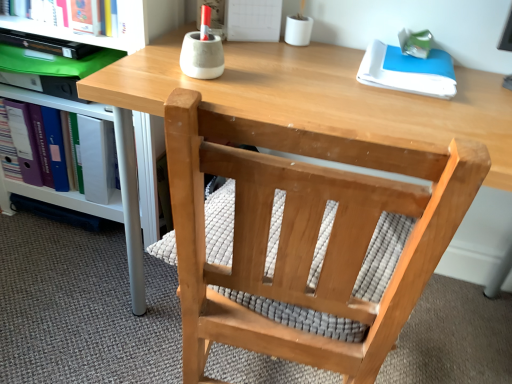
You are a GUI agent. You are given a task and a screenshot of the screen. Output one action in this format:
    pyautogui.click(x=<x>, y=<y>)
    Task: Click on the vacant region in front of white paper at upper right
    This screenshot has width=512, height=384.
    Given the screenshot: What is the action you would take?
    pyautogui.click(x=409, y=111)